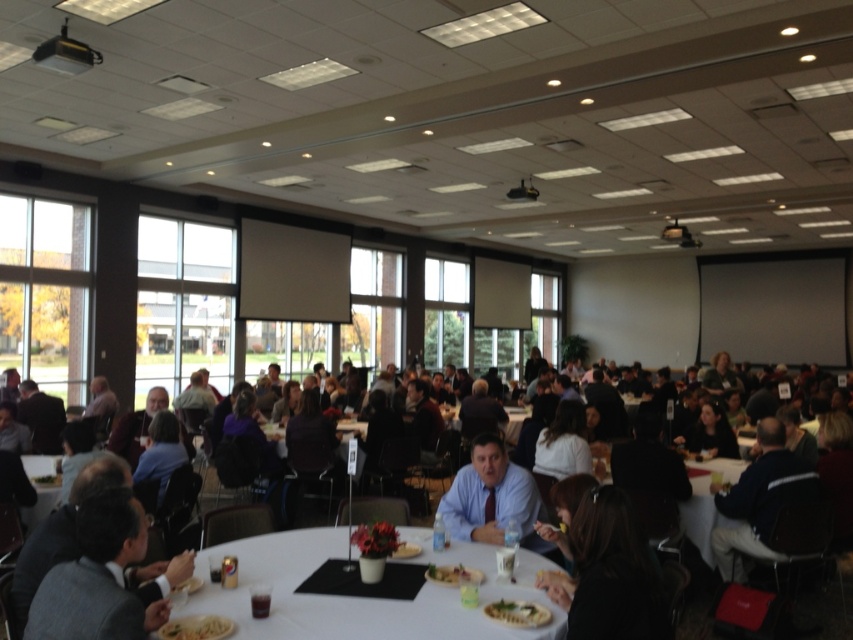
Question: Which object is the closest to the dark blue shirt at center?

Choices:
 (A) yellow matte pasta at lower left
 (B) green matte salad at lower left
 (C) dark brown hair at lower right
 (D) yellowish matte plate at center

Answer: (C)

Question: Which is farther from the white plastic table at lower left?

Choices:
 (A) dark brown hair at lower right
 (B) white paper plate at center
 (C) yellow matte pasta at lower left

Answer: (A)

Question: Does dark brown hair at lower right appear over white plastic table at lower left?

Choices:
 (A) no
 (B) yes

Answer: (B)

Question: Among these points, which one is nearest to the camera?

Choices:
 (A) (138, 545)
 (B) (289, 554)
 (C) (490, 611)

Answer: (A)

Question: Is dark brown hair at lower right wider than green matte salad at lower left?

Choices:
 (A) no
 (B) yes

Answer: (B)

Question: Does white glossy table at center appear on the right side of dark brown hair at lower right?

Choices:
 (A) yes
 (B) no

Answer: (B)